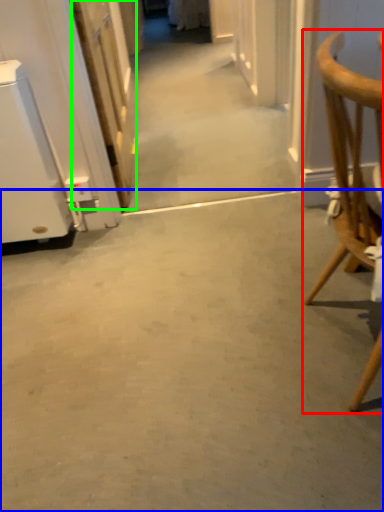
Question: Estimate the real-world distances between objects in this image. Which object is closer to chair (highlighted by a red box), concrete (highlighted by a blue box) or door (highlighted by a green box)?

Choices:
 (A) concrete
 (B) door

Answer: (A)